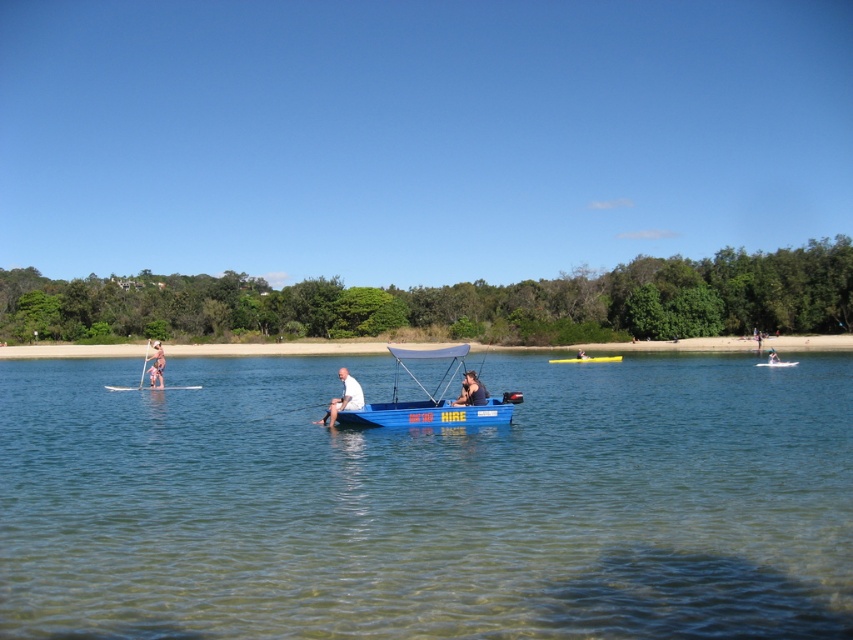
Based on the photo, you are a photographer standing on the lakeside dock. You want to take a photo of the dark blue fabric boat at center and the tan skin person at center. Based on their positions, which object should you focus on first to ensure both are in frame?

The dark blue fabric boat at center is located below the tan skin person at center, so you should focus on the tan skin person at center first to ensure both are in frame.

You are standing on the lakeside and want to take a photo of the blue plastic boat at center. If you are at the origin point of the coordinate system, where should you aim your camera to capture the boat in the frame?

The blue plastic boat at center is located at coordinate point 0.622 on the x axis and 0.511 on the y axis, so aim your camera towards those coordinates to capture it.

You are a photographer planning to capture the reflection of the dark blue fabric boat at center and the yellow plastic canoe at center in the water. Which object will have a clearer reflection due to its position relative to the water surface?

The dark blue fabric boat at center will have a clearer reflection because it is positioned above the yellow plastic canoe at center, making its reflection less distorted by water movement.